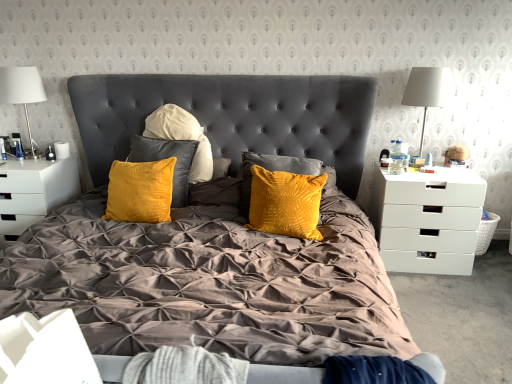
Locate an element on the screen. The height and width of the screenshot is (384, 512). free space to the back side of clear plastic bottle at right side is located at coordinates (x=396, y=167).